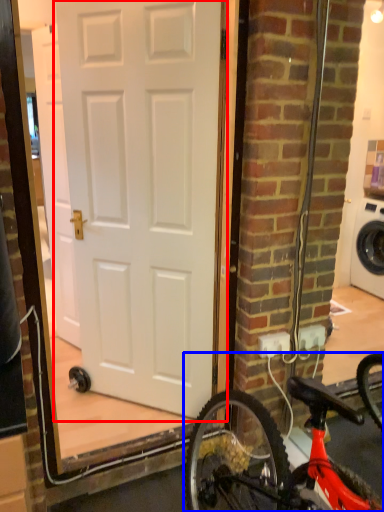
Question: Among these objects, which one is farthest to the camera, door (highlighted by a red box) or bicycle (highlighted by a blue box)?

Choices:
 (A) door
 (B) bicycle

Answer: (A)